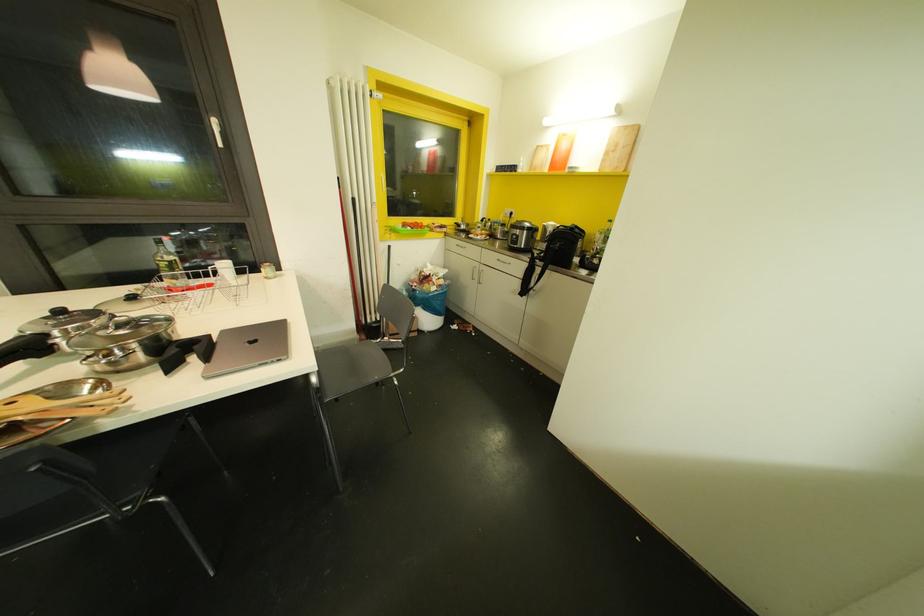
Locate an element on the screen. This screenshot has width=924, height=616. white window handle is located at coordinates (215, 131).